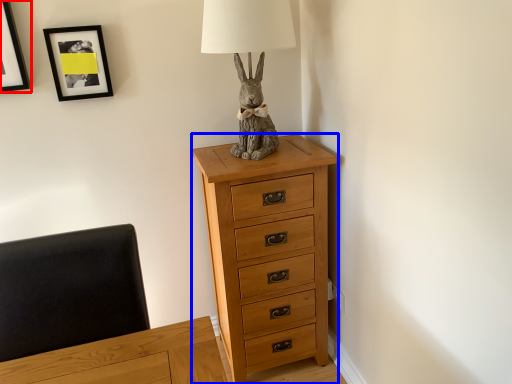
Question: Among these objects, which one is farthest to the camera, picture frame (highlighted by a red box) or chest of drawers (highlighted by a blue box)?

Choices:
 (A) picture frame
 (B) chest of drawers

Answer: (B)